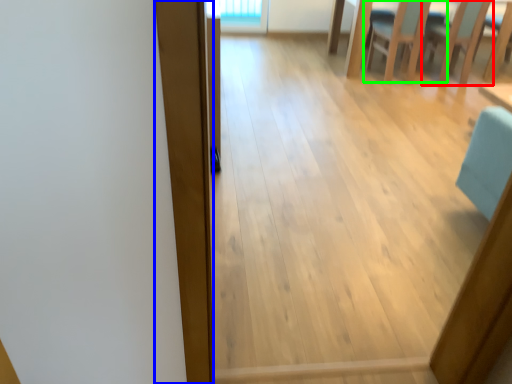
Question: Estimate the real-world distances between objects in this image. Which object is closer to armchair (highlighted by a red box), plank (highlighted by a blue box) or chair (highlighted by a green box)?

Choices:
 (A) plank
 (B) chair

Answer: (B)